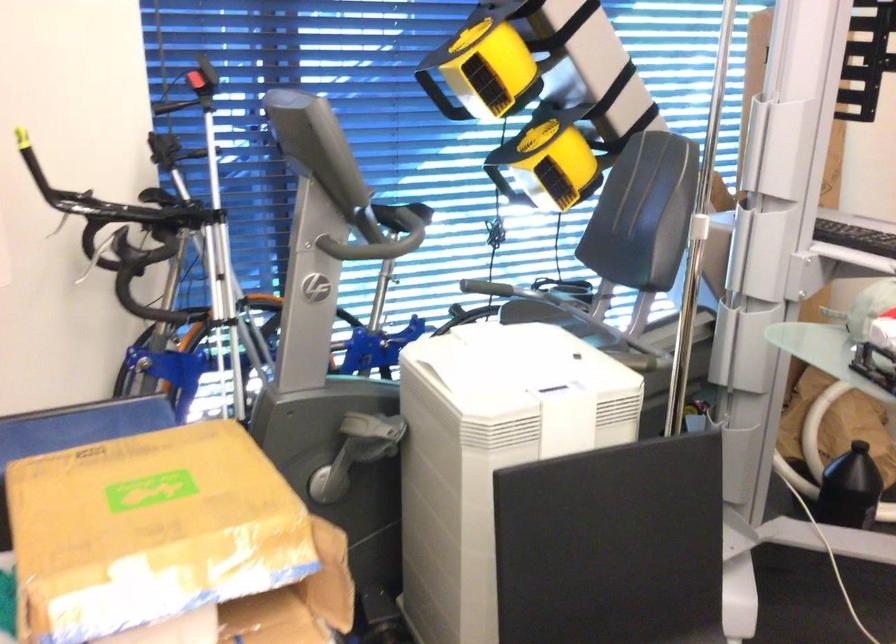
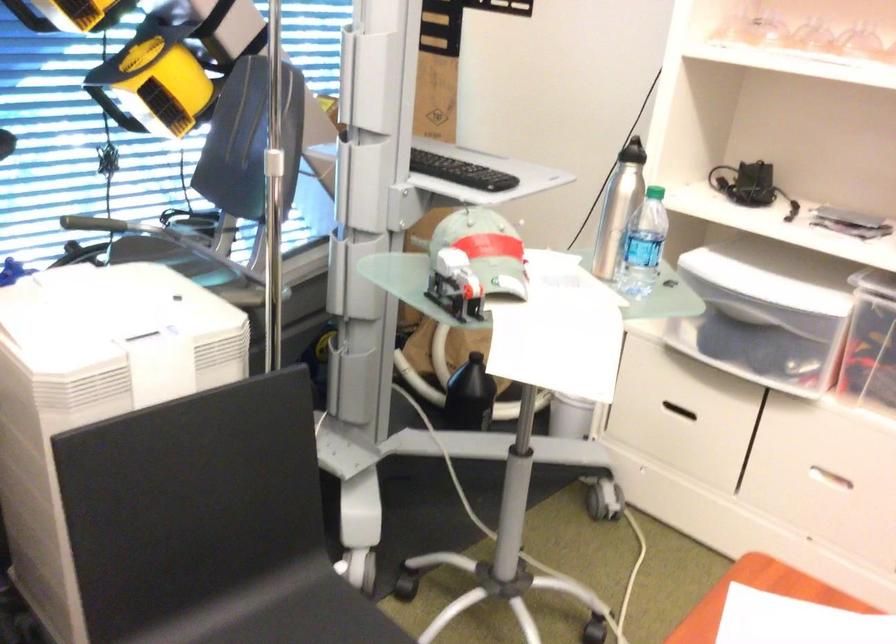
Question: The images are taken continuously from a first-person perspective. In which direction is your viewpoint rotating?

Choices:
 (A) Left
 (B) Right
 (C) Up
 (D) Down

Answer: (B)